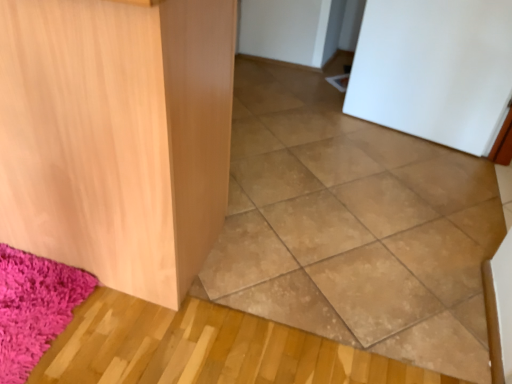
Locate an element on the screen. The image size is (512, 384). matte wood door at left is located at coordinates (117, 136).

Image resolution: width=512 pixels, height=384 pixels. Describe the element at coordinates (117, 136) in the screenshot. I see `matte wood door at left` at that location.

Where is `matte wood door at left`? Image resolution: width=512 pixels, height=384 pixels. matte wood door at left is located at coordinates (117, 136).